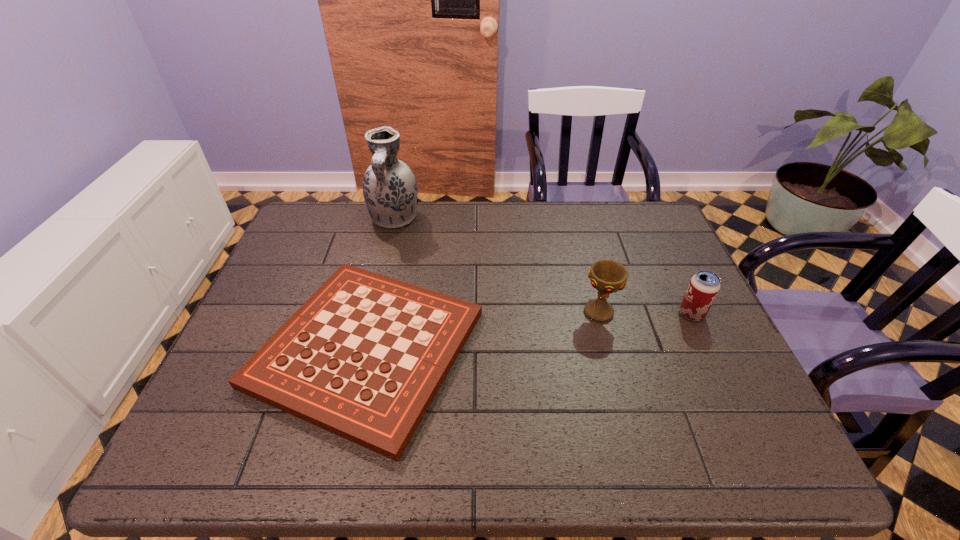
Image resolution: width=960 pixels, height=540 pixels. I want to click on object that is at the near edge, so coord(363,358).

Locate an element on the screen. The image size is (960, 540). object that is positioned at the left edge is located at coordinates (363, 358).

Find the location of `object present at the right edge`. object present at the right edge is located at coordinates (704, 286).

Where is `object positioned at the near left corner`? The image size is (960, 540). object positioned at the near left corner is located at coordinates (363, 358).

Locate an element on the screen. vacant area at the far edge of the desktop is located at coordinates (588, 211).

This screenshot has width=960, height=540. In the image, there is a desktop. In order to click on free space at the left edge in this screenshot , I will do `click(223, 379)`.

In order to click on vacant space at the right edge of the desktop in this screenshot , I will do `click(715, 334)`.

The image size is (960, 540). Identify the location of vacant space at the far left corner. (341, 237).

Locate an element on the screen. This screenshot has height=540, width=960. vacant space at the far right corner of the desktop is located at coordinates (616, 208).

Image resolution: width=960 pixels, height=540 pixels. In order to click on vacant space at the near right corner in this screenshot , I will do `click(728, 434)`.